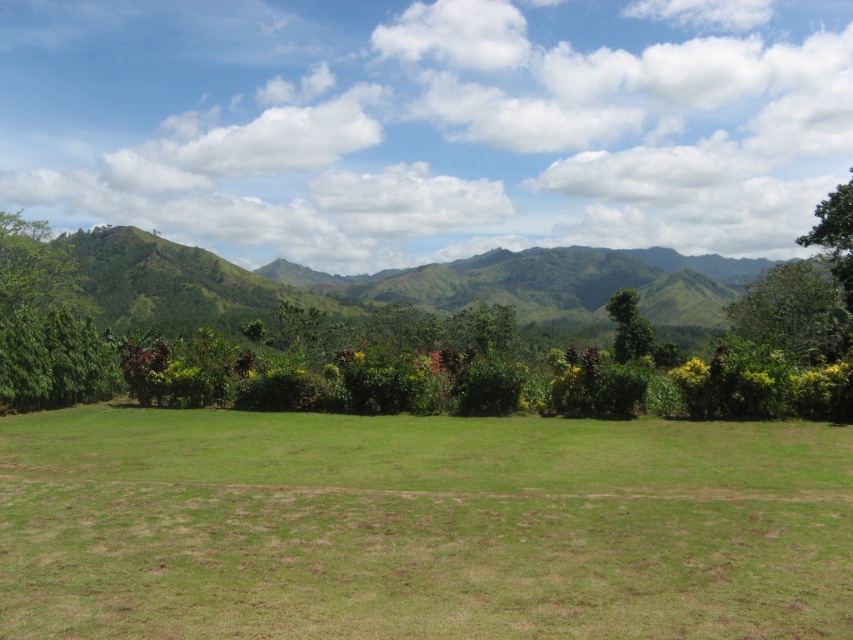
Question: Which of the following is the farthest from the observer?

Choices:
 (A) (628, 356)
 (B) (697, 301)
 (C) (839, 333)

Answer: (B)

Question: Can you confirm if green grass at center is wider than green leafy tree at right?

Choices:
 (A) no
 (B) yes

Answer: (A)

Question: Where is green leafy tree at right located in relation to green leafy tree at center in the image?

Choices:
 (A) above
 (B) below

Answer: (A)

Question: Does green leafy tree at left have a smaller size compared to green leafy tree at upper right?

Choices:
 (A) no
 (B) yes

Answer: (B)

Question: Which point appears closest to the camera in this image?

Choices:
 (A) (750, 312)
 (B) (39, 316)
 (C) (618, 356)
 (D) (448, 618)

Answer: (D)

Question: Which object appears farthest from the camera in this image?

Choices:
 (A) green leafy tree at upper right
 (B) green leafy tree at center

Answer: (B)